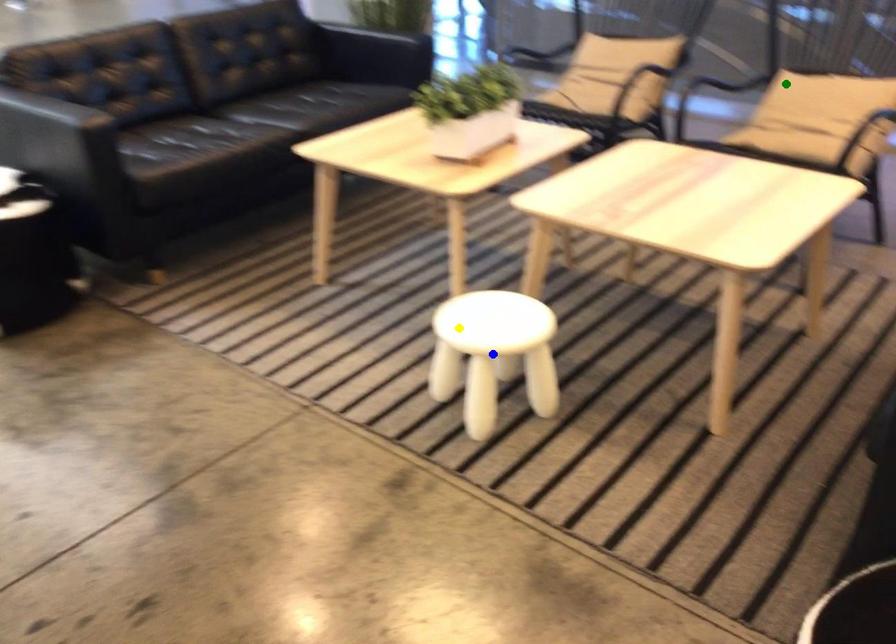
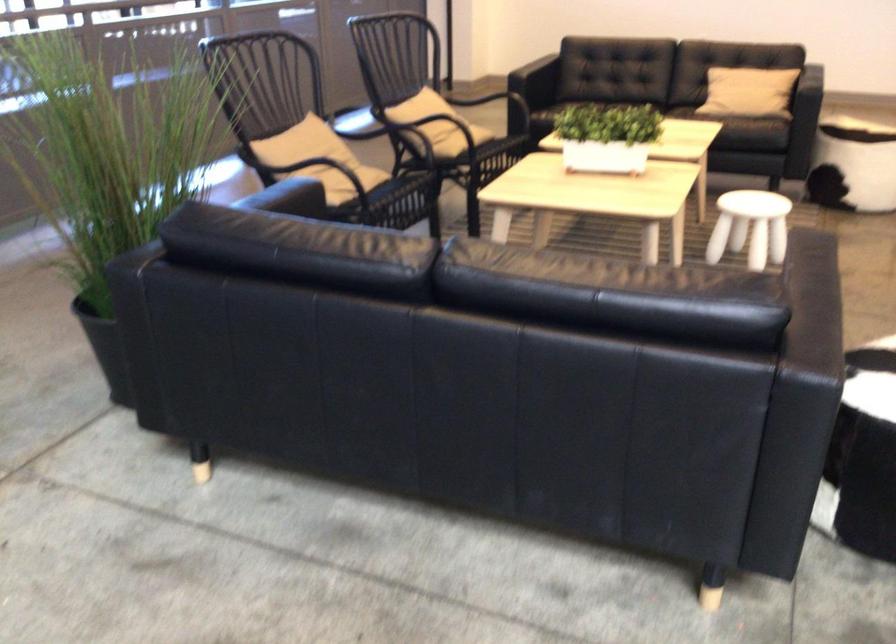
I am providing you with two images of the same scene from different viewpoints. Three points are marked in image1. Which point corresponds to a part or object that is occluded in image2?In image1, three points are marked. Which of them correspond to a part or object that is occluded in image2?Among the three points shown in image1, which one corresponds to a part or object that is no longer visible due to occlusion in image2?

Invisible in image2: blue point.